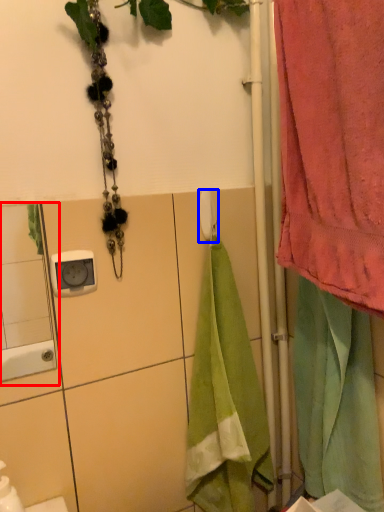
Question: Among these objects, which one is farthest to the camera, mirror (highlighted by a red box) or towel bar (highlighted by a blue box)?

Choices:
 (A) mirror
 (B) towel bar

Answer: (B)